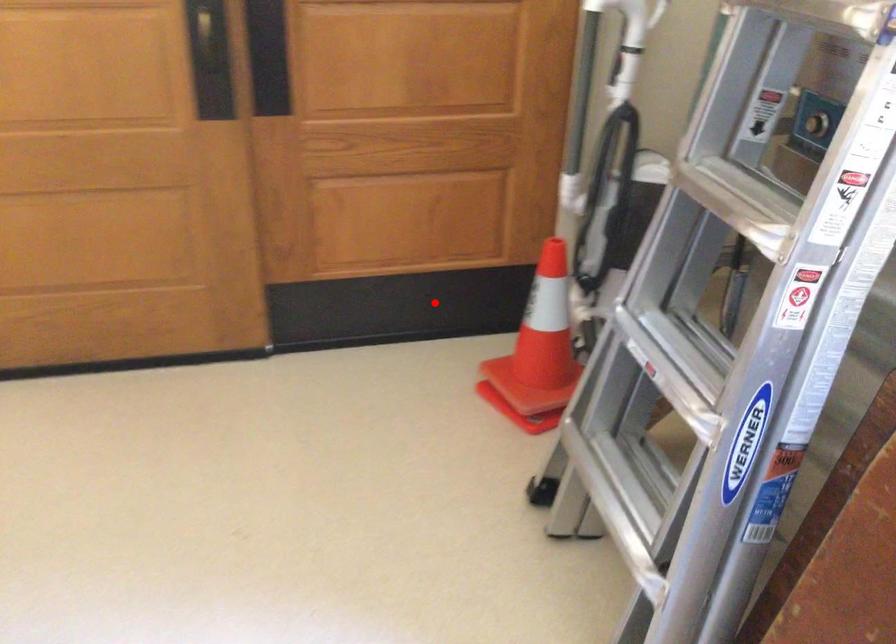
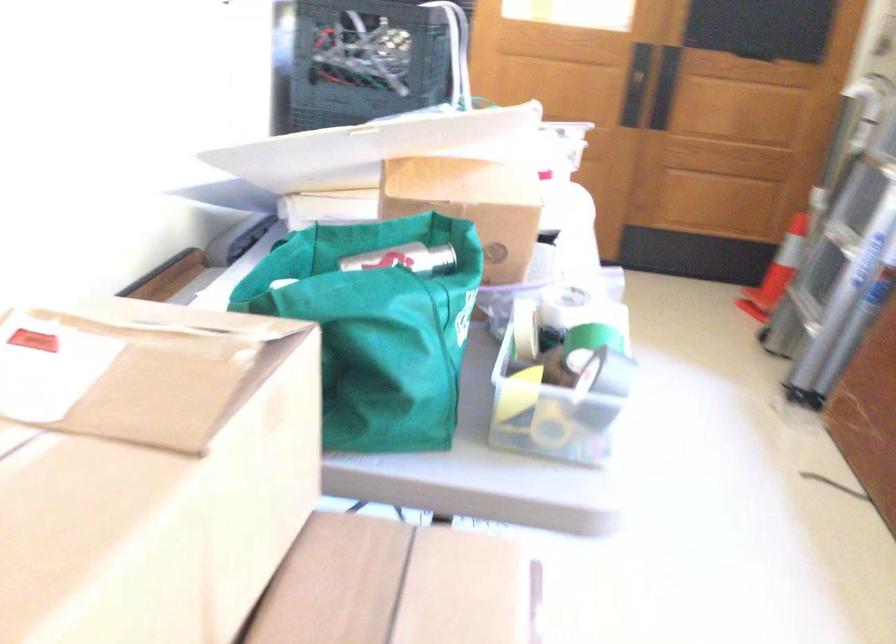
Find the pixel in the second image that matches the highlighted location in the first image.

(745, 237)